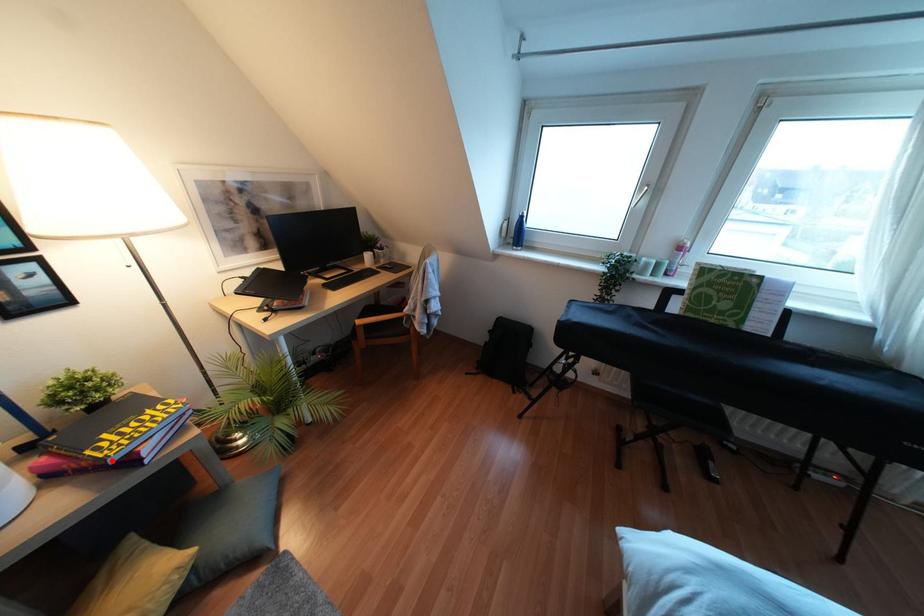
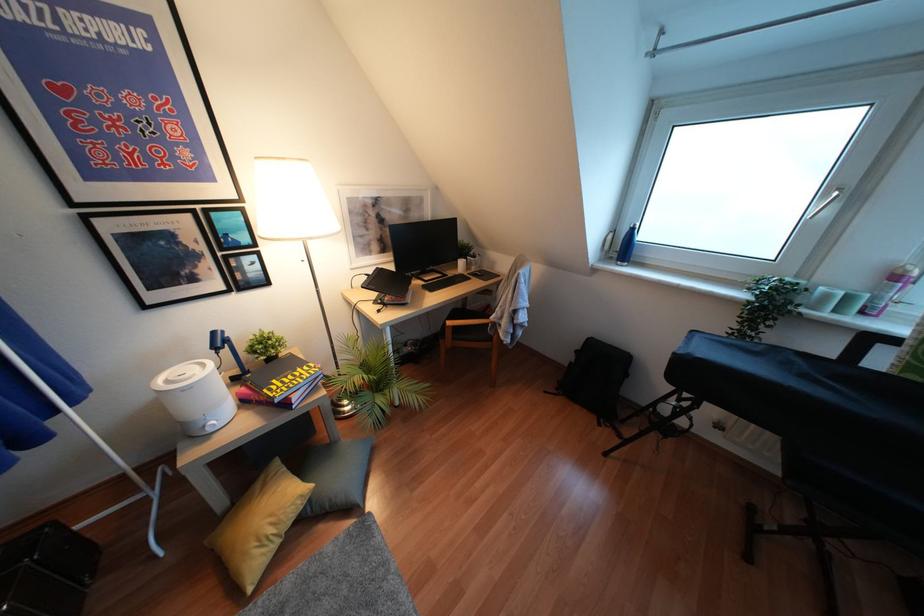
Question: I am providing you with two images of the same scene from different viewpoints. Image1 has a red point marked. In image2, the corresponding 3D location appears at what relative position? Reply with the corresponding letter.

Choices:
 (A) Closer
 (B) Farther

Answer: (B)